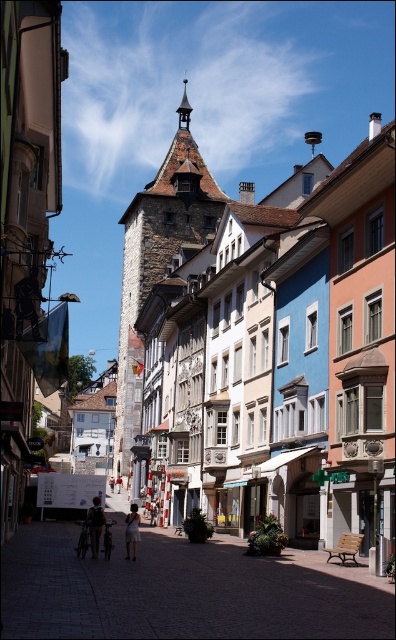
Can you confirm if dark blue jeans at center is bigger than white cotton dress at center?

Actually, dark blue jeans at center might be smaller than white cotton dress at center.

Image resolution: width=396 pixels, height=640 pixels. What do you see at coordinates (95, 524) in the screenshot?
I see `dark blue jeans at center` at bounding box center [95, 524].

Where is `dark blue jeans at center`? The width and height of the screenshot is (396, 640). dark blue jeans at center is located at coordinates [95, 524].

Is smooth stone pavement at center closer to the viewer compared to white cotton dress at center?

Yes, smooth stone pavement at center is in front of white cotton dress at center.

Between smooth stone pavement at center and white cotton dress at center, which one is positioned lower?

Positioned lower is white cotton dress at center.

Locate an element on the screen. This screenshot has height=640, width=396. smooth stone pavement at center is located at coordinates (182, 592).

Locate an element on the screen. The height and width of the screenshot is (640, 396). smooth stone pavement at center is located at coordinates (182, 592).

From the picture: Does stone tower at center appear on the right side of dark blue jeans at center?

No, stone tower at center is not to the right of dark blue jeans at center.

Find the location of a particular element. The width and height of the screenshot is (396, 640). stone tower at center is located at coordinates (158, 260).

At what (x,y) coordinates should I click in order to perform the action: click on stone tower at center. Please return your answer as a coordinate pair (x, y). Looking at the image, I should click on (158, 260).